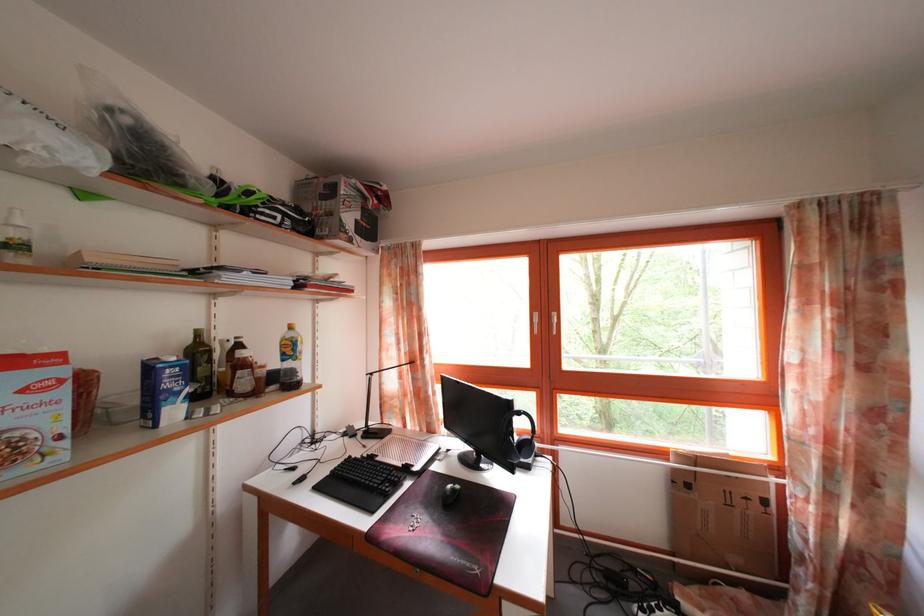
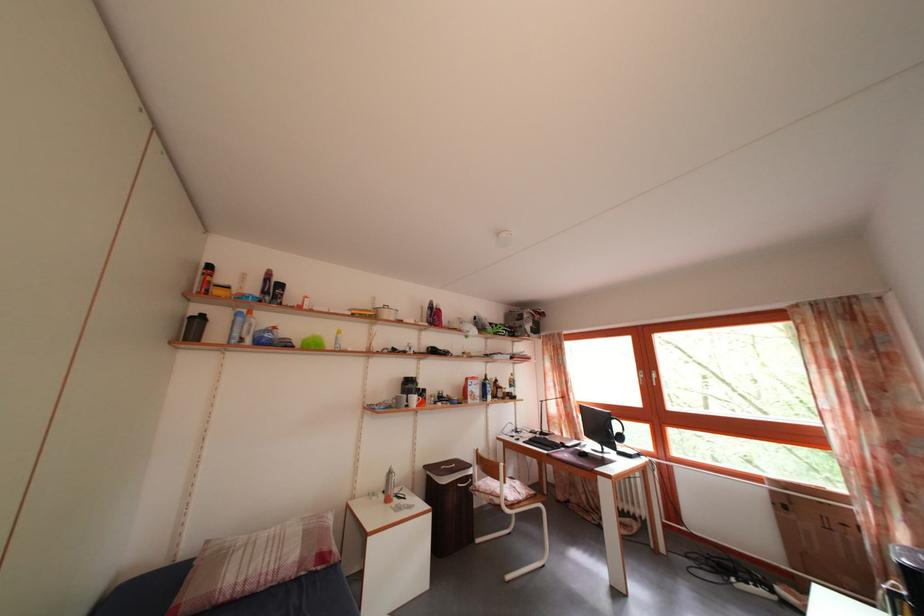
Question: I am providing you with two images of the same scene from different viewpoints. Please identify which objects are invisible in image2.

Choices:
 (A) computer mouse
 (B) black thermos bottle
 (C) sofa sitting surface
 (D) none of these

Answer: (D)